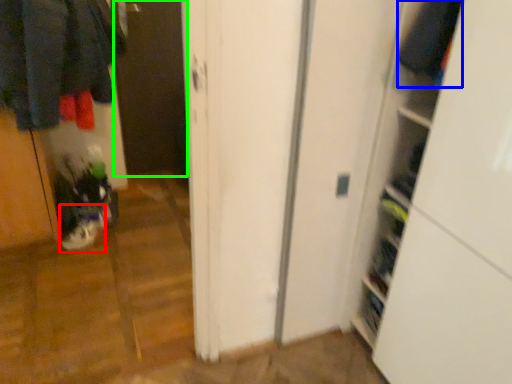
Question: Based on their relative distances, which object is farther from footwear (highlighted by a red box)? Choose from clothing (highlighted by a blue box) and screen door (highlighted by a green box).

Choices:
 (A) clothing
 (B) screen door

Answer: (A)